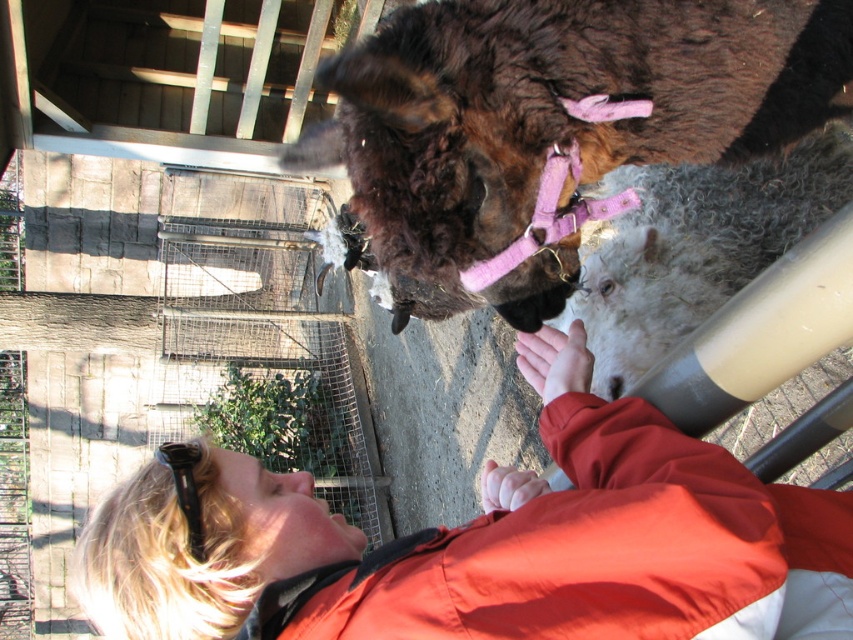
Question: Does blonde hair at upper left have a smaller size compared to brown fuzzy llama at upper center?

Choices:
 (A) no
 (B) yes

Answer: (B)

Question: Among these objects, which one is farthest from the camera?

Choices:
 (A) brown fuzzy llama at upper center
 (B) blonde hair at upper left

Answer: (A)

Question: Is blonde hair at upper left further to camera compared to brown fuzzy llama at upper center?

Choices:
 (A) no
 (B) yes

Answer: (A)

Question: Does blonde hair at upper left appear on the left side of brown fuzzy llama at upper center?

Choices:
 (A) yes
 (B) no

Answer: (A)

Question: Which point is closer to the camera taking this photo?

Choices:
 (A) (654, 76)
 (B) (161, 476)

Answer: (B)